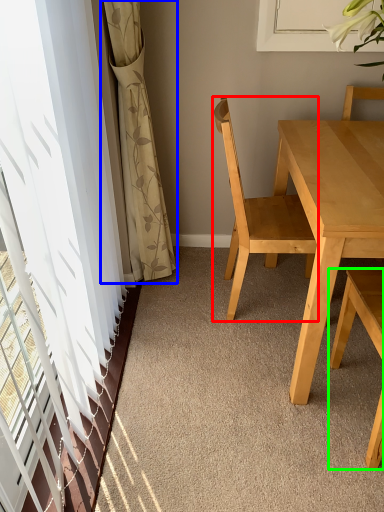
Question: Which is nearer to the chair (highlighted by a red box)? curtain (highlighted by a blue box) or chair (highlighted by a green box).

Choices:
 (A) curtain
 (B) chair

Answer: (B)